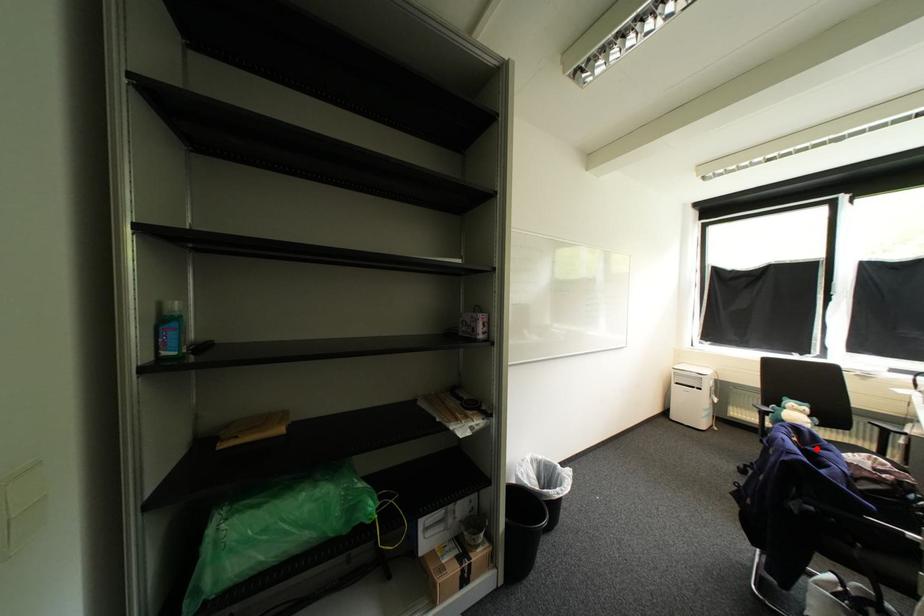
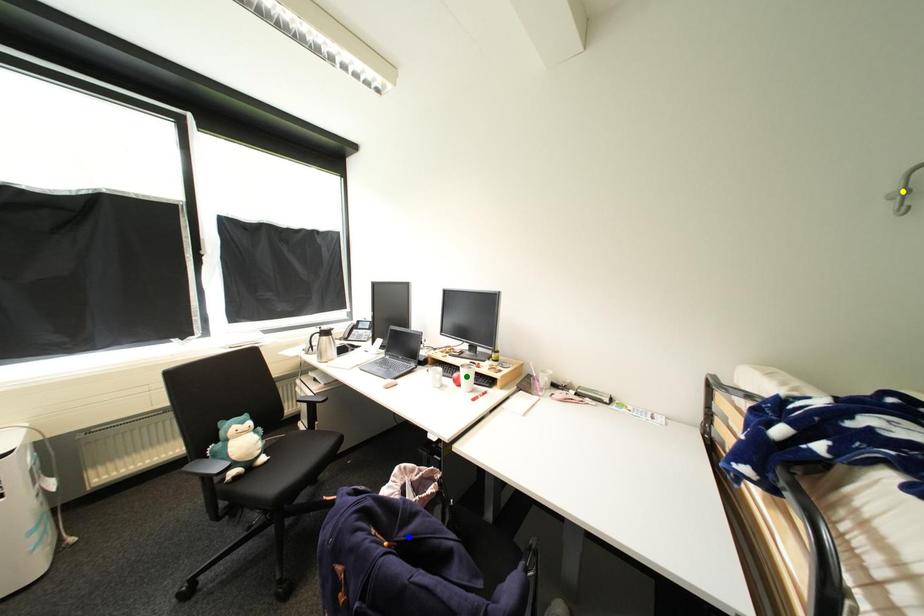
Question: I am providing you with two images of the same scene from different viewpoints. A red point is marked on the first image. You are given multiple points on the second image. Which mark in image 2 goes with the point in image 1?

Choices:
 (A) yellow point
 (B) green point
 (C) blue point

Answer: (C)